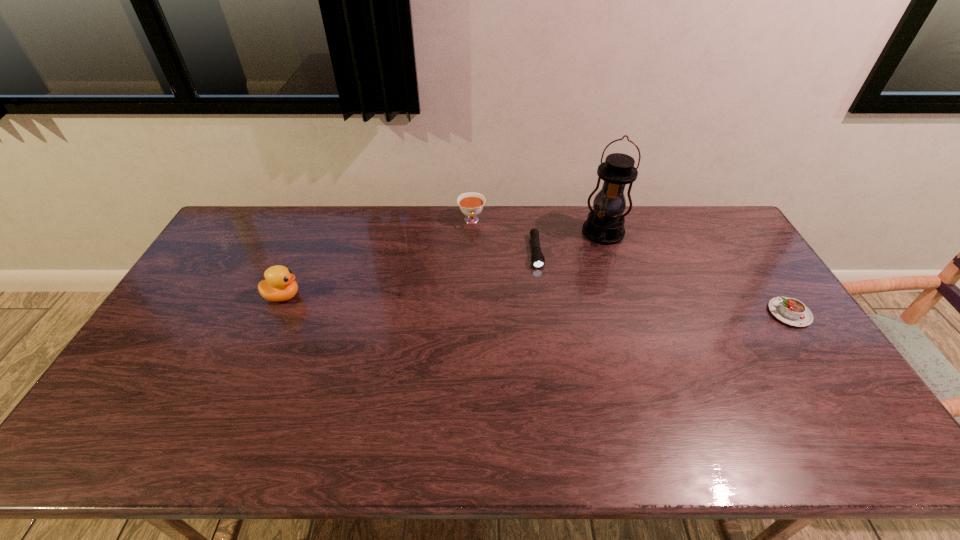
Where is `duckling`? The image size is (960, 540). duckling is located at coordinates (279, 285).

In order to click on the fourth shortest object in this screenshot , I will do `click(279, 285)`.

Where is `the rightmost object`? the rightmost object is located at coordinates (791, 311).

Locate an element on the screen. The width and height of the screenshot is (960, 540). the third object from right to left is located at coordinates (537, 258).

Locate an element on the screen. This screenshot has width=960, height=540. the fourth object from left to right is located at coordinates (605, 223).

Locate an element on the screen. The height and width of the screenshot is (540, 960). lantern is located at coordinates (605, 223).

In order to click on the fourth object from right to left in this screenshot , I will do (x=471, y=204).

The image size is (960, 540). Identify the location of teacup. (471, 204).

Locate an element on the screen. This screenshot has width=960, height=540. vacant space located 0.240m on the face of the second tallest object is located at coordinates (379, 296).

You are a GUI agent. You are given a task and a screenshot of the screen. Output one action in this format:
    pyautogui.click(x=<x>, y=<y>)
    Task: Click on the vacant space located 0.390m on the left of the rightmost object
    This screenshot has width=960, height=540.
    Given the screenshot: What is the action you would take?
    pyautogui.click(x=640, y=313)